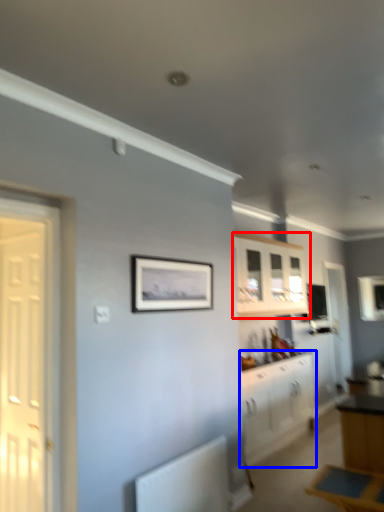
Question: Which of the following is the closest to the observer, cabinetry (highlighted by a red box) or cabinetry (highlighted by a blue box)?

Choices:
 (A) cabinetry
 (B) cabinetry

Answer: (B)